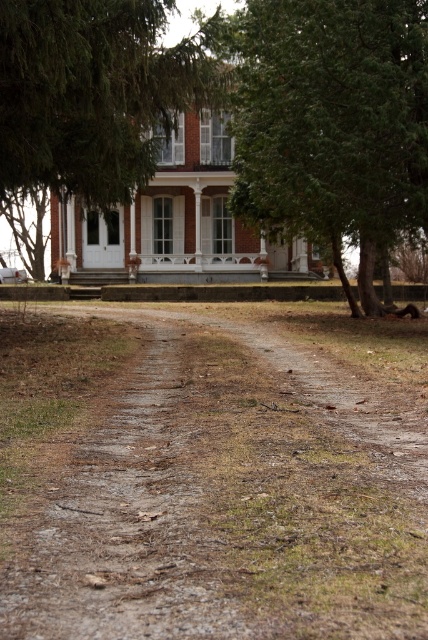
You are standing at the entrance of the house and want to walk to the green textured tree at center. Which direction should you go relative to the brown gravel path at center?

The brown gravel path at center is to the left of the green textured tree at center, so you should walk to the right of the brown gravel path at center to reach the green textured tree at center.

From the picture: You are a visitor approaching the house and notice the brown gravel path at center and the green leafy tree at upper left. Which object is positioned to the right of the other?

The brown gravel path at center is to the right of green leafy tree at upper left.